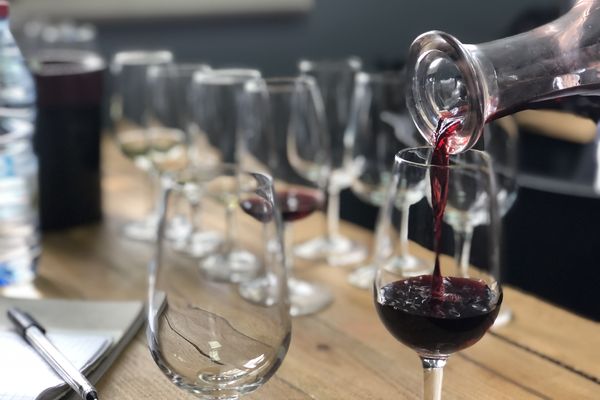
This screenshot has height=400, width=600. Identify the location of empty glasses. (189, 308), (505, 141), (379, 126), (340, 100), (223, 110), (178, 94).